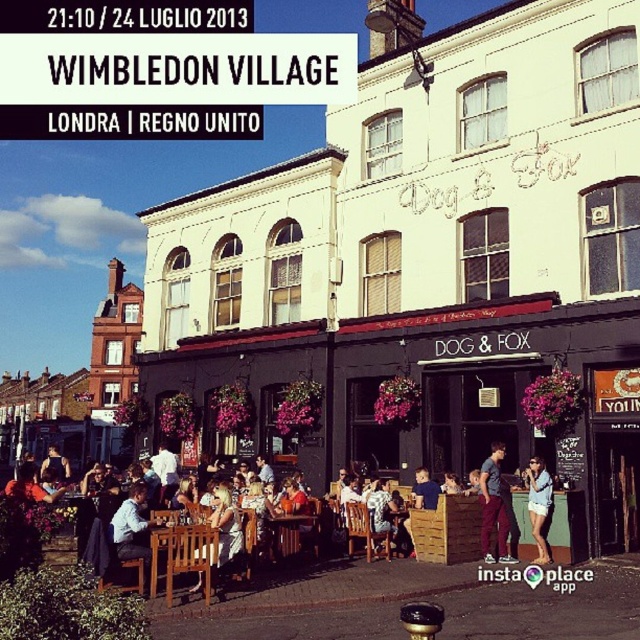
Consider the image. You are a photographer standing at the entrance of the Dog and Fox pub. You see a wooden chair at lower center and a leather jacket at lower left. Which object is positioned higher from the ground?

The wooden chair at lower center is above the leather jacket at lower left, so it is positioned higher from the ground.

You are standing in front of the Dog and Fox pub and want to take a photo of both the matte purple pants at lower right and the matte blue shirt at center. Which object should you focus on first to ensure both are in clear view?

You should focus on the matte purple pants at lower right first because it is closer to the viewer than the matte blue shirt at center, ensuring both are in focus when taking the photo.

You are a photographer standing at the entrance of the Dog and Fox pub. You want to take a photo of both the wooden chair at lower center and the matte purple pants at lower right in the same frame. Can you position yourself so that both objects are within your camera view? Explain your reasoning.

The wooden chair at lower center and the matte purple pants at lower right are 4.66 meters apart from each other. Since the photographer is at the entrance, they can likely position themselves to include both objects in the frame as the distance between them is manageable for a wide enough lens or by adjusting their position to capture both within the camera view.